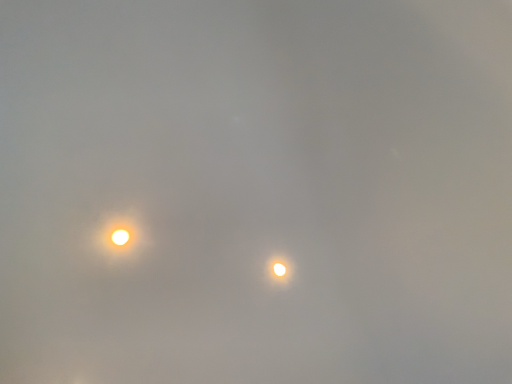
Where is `bright yellow orb at upper left, which ranks as the 1th moonlight in front-to-back order`? This screenshot has height=384, width=512. bright yellow orb at upper left, which ranks as the 1th moonlight in front-to-back order is located at coordinates (119, 234).

Describe the element at coordinates (119, 234) in the screenshot. This screenshot has width=512, height=384. I see `bright yellow orb at upper left, arranged as the 1th moonlight when viewed from the top` at that location.

Describe the element at coordinates (279, 270) in the screenshot. The height and width of the screenshot is (384, 512). I see `bright white sphere at center, which is counted as the first moonlight, starting from the back` at that location.

Where is `bright white sphere at center, the first moonlight ordered from the bottom`? The width and height of the screenshot is (512, 384). bright white sphere at center, the first moonlight ordered from the bottom is located at coordinates (279, 270).

Identify the location of bright yellow orb at upper left, the 1th moonlight from the left. (119, 234).

In the image, is bright yellow orb at upper left, which appears as the second moonlight when viewed from the right, on the left side or the right side of bright white sphere at center, arranged as the second moonlight when viewed from the front?

In the image, bright yellow orb at upper left, which appears as the second moonlight when viewed from the right, appears on the left side of bright white sphere at center, arranged as the second moonlight when viewed from the front.

Consider the image. Between bright yellow orb at upper left, arranged as the 1th moonlight when viewed from the top, and bright white sphere at center, the 2th moonlight from the left, which one is positioned behind?

Positioned behind is bright white sphere at center, the 2th moonlight from the left.

Considering the points (115, 252) and (277, 269), which point is behind, point (115, 252) or point (277, 269)?

Positioned behind is point (277, 269).

From the image's perspective, is bright yellow orb at upper left, arranged as the 1th moonlight when viewed from the top, on bright white sphere at center, arranged as the second moonlight when viewed from the front?

Yes, from the image's perspective, bright yellow orb at upper left, arranged as the 1th moonlight when viewed from the top, is on top of bright white sphere at center, arranged as the second moonlight when viewed from the front.

From a real-world perspective, between bright yellow orb at upper left, the 2th moonlight ordered from the bottom, and bright white sphere at center, the 1th moonlight from the right, who is vertically lower?

bright yellow orb at upper left, the 2th moonlight ordered from the bottom, is physically lower.

Does bright yellow orb at upper left, which ranks as the 1th moonlight in front-to-back order, have a lesser width compared to bright white sphere at center, arranged as the second moonlight when viewed from the front?

No.

Does bright yellow orb at upper left, arranged as the 1th moonlight when viewed from the top, have a greater height compared to bright white sphere at center, which is counted as the first moonlight, starting from the back?

Incorrect, the height of bright yellow orb at upper left, arranged as the 1th moonlight when viewed from the top, is not larger of that of bright white sphere at center, which is counted as the first moonlight, starting from the back.

Considering the relative sizes of bright yellow orb at upper left, the 2th moonlight ordered from the bottom, and bright white sphere at center, arranged as the second moonlight when viewed from the front, in the image provided, is bright yellow orb at upper left, the 2th moonlight ordered from the bottom, smaller than bright white sphere at center, arranged as the second moonlight when viewed from the front,?

No, bright yellow orb at upper left, the 2th moonlight ordered from the bottom, is not smaller than bright white sphere at center, arranged as the second moonlight when viewed from the front.

Would you say bright yellow orb at upper left, which ranks as the 1th moonlight in front-to-back order, is outside bright white sphere at center, which appears as the second moonlight when viewed from the top?

Yes, bright yellow orb at upper left, which ranks as the 1th moonlight in front-to-back order, is located beyond the bounds of bright white sphere at center, which appears as the second moonlight when viewed from the top.

Is bright yellow orb at upper left, which is counted as the 2th moonlight, starting from the back, not close to bright white sphere at center, arranged as the second moonlight when viewed from the front?

bright yellow orb at upper left, which is counted as the 2th moonlight, starting from the back, is near bright white sphere at center, arranged as the second moonlight when viewed from the front, not far away.

Is bright yellow orb at upper left, the 2th moonlight ordered from the bottom, facing away from bright white sphere at center, which is counted as the first moonlight, starting from the back?

No.

Image resolution: width=512 pixels, height=384 pixels. I want to click on moonlight on the right of bright yellow orb at upper left, which ranks as the 1th moonlight in front-to-back order, so click(279, 270).

Is bright white sphere at center, the first moonlight ordered from the bottom, at the left side of bright yellow orb at upper left, which appears as the second moonlight when viewed from the right?

No, bright white sphere at center, the first moonlight ordered from the bottom, is not to the left of bright yellow orb at upper left, which appears as the second moonlight when viewed from the right.

Does bright white sphere at center, the 1th moonlight from the right, come in front of bright yellow orb at upper left, which appears as the second moonlight when viewed from the right?

No, it is not.

Which is less distant, [270,260] or [106,235]?

Clearly, point [270,260] is more distant from the camera than point [106,235].

From the image's perspective, who appears lower, bright white sphere at center, the 1th moonlight from the right, or bright yellow orb at upper left, which is counted as the 2th moonlight, starting from the back?

From the image's view, bright white sphere at center, the 1th moonlight from the right, is below.

From a real-world perspective, is bright white sphere at center, arranged as the second moonlight when viewed from the front, above or below bright yellow orb at upper left, which is counted as the 2th moonlight, starting from the back?

Clearly, from a real-world perspective, bright white sphere at center, arranged as the second moonlight when viewed from the front, is above bright yellow orb at upper left, which is counted as the 2th moonlight, starting from the back.

Based on the photo, which of these two, bright white sphere at center, the 2th moonlight from the left, or bright yellow orb at upper left, the 2th moonlight ordered from the bottom, is thinner?

bright white sphere at center, the 2th moonlight from the left.

Does bright white sphere at center, arranged as the second moonlight when viewed from the front, have a greater height compared to bright yellow orb at upper left, the 2th moonlight ordered from the bottom?

Correct, bright white sphere at center, arranged as the second moonlight when viewed from the front, is much taller as bright yellow orb at upper left, the 2th moonlight ordered from the bottom.

Which of these two, bright white sphere at center, which appears as the second moonlight when viewed from the top, or bright yellow orb at upper left, the 2th moonlight ordered from the bottom, is smaller?

With smaller size is bright white sphere at center, which appears as the second moonlight when viewed from the top.

Could bright yellow orb at upper left, which is counted as the 2th moonlight, starting from the back, be considered to be inside bright white sphere at center, the 2th moonlight from the left?

No, bright yellow orb at upper left, which is counted as the 2th moonlight, starting from the back, is located outside of bright white sphere at center, the 2th moonlight from the left.

Are bright white sphere at center, the 2th moonlight from the left, and bright yellow orb at upper left, which appears as the second moonlight when viewed from the right, beside each other?

There is a gap between bright white sphere at center, the 2th moonlight from the left, and bright yellow orb at upper left, which appears as the second moonlight when viewed from the right.

Is bright white sphere at center, the first moonlight ordered from the bottom, looking in the opposite direction of bright yellow orb at upper left, arranged as the 1th moonlight when viewed from the top?

No, bright white sphere at center, the first moonlight ordered from the bottom,'s orientation is not away from bright yellow orb at upper left, arranged as the 1th moonlight when viewed from the top.

What's the angular difference between bright white sphere at center, the 2th moonlight from the left, and bright yellow orb at upper left, which appears as the second moonlight when viewed from the right,'s facing directions?

The facing directions of bright white sphere at center, the 2th moonlight from the left, and bright yellow orb at upper left, which appears as the second moonlight when viewed from the right, are 0.000274 degrees apart.

Where is `moonlight on the right of bright yellow orb at upper left, the 1th moonlight from the left`? moonlight on the right of bright yellow orb at upper left, the 1th moonlight from the left is located at coordinates (x=279, y=270).

This screenshot has height=384, width=512. What are the coordinates of `moonlight on the left of bright white sphere at center, arranged as the second moonlight when viewed from the front` in the screenshot? It's located at (119, 234).

The image size is (512, 384). What are the coordinates of `moonlight below the bright white sphere at center, arranged as the second moonlight when viewed from the front (from a real-world perspective)` in the screenshot? It's located at (119, 234).